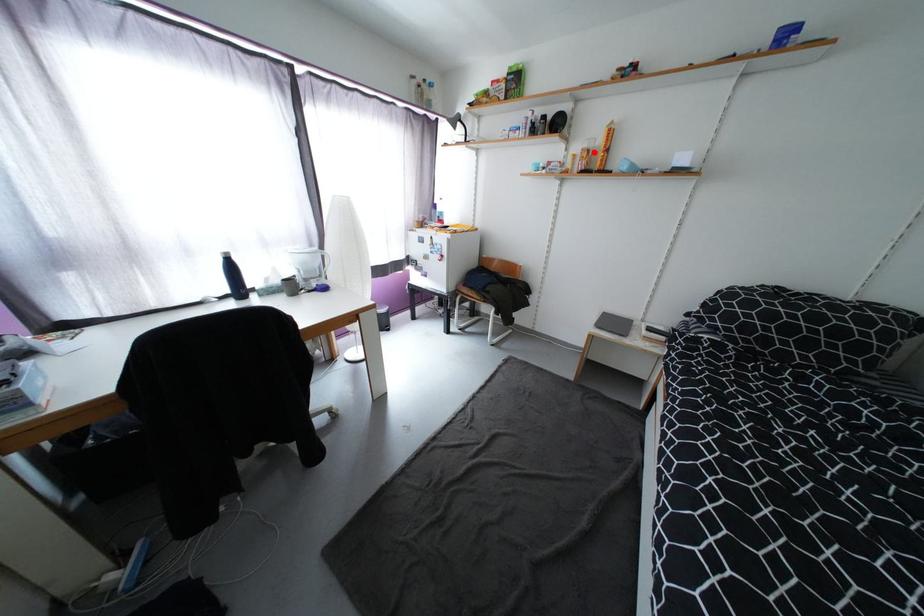
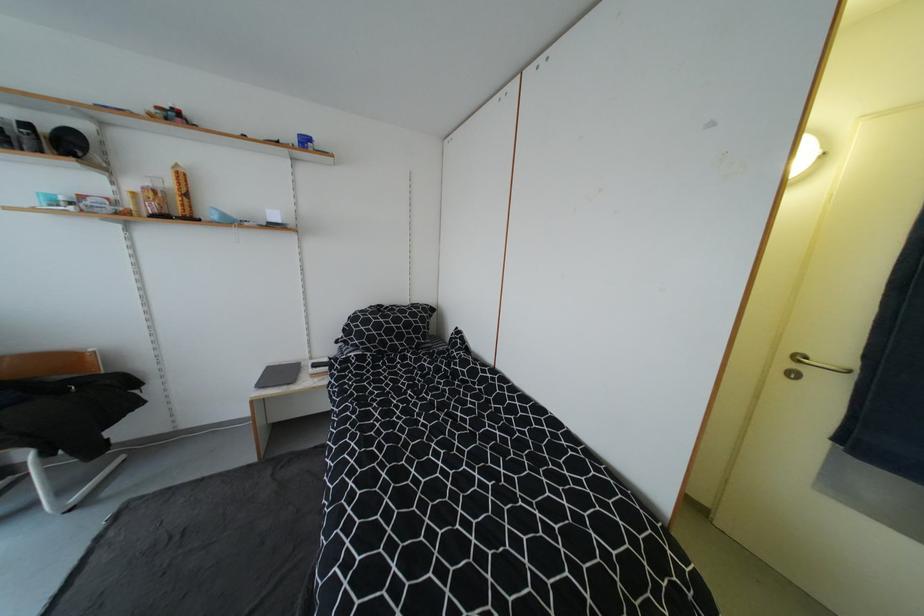
Find the pixel in the second image that matches the highlighted location in the first image.

(161, 193)